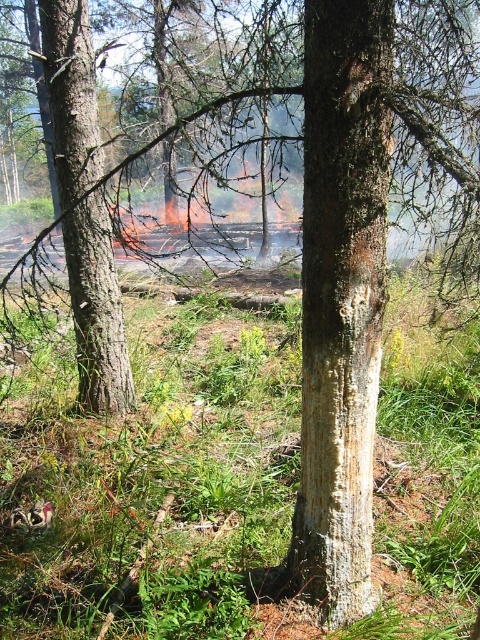
Is the position of smooth brown tree trunk at center more distant than that of smooth brown tree trunk at left?

No, it is in front of smooth brown tree trunk at left.

Is point (372, 365) in front of point (68, 227)?

Yes, point (372, 365) is in front of point (68, 227).

Between point (376, 188) and point (71, 157), which one is positioned in front?

Positioned in front is point (376, 188).

You are a GUI agent. You are given a task and a screenshot of the screen. Output one action in this format:
    pyautogui.click(x=<x>, y=<y>)
    Task: Click on the smooth brown tree trunk at center
    Image resolution: width=480 pixels, height=640 pixels.
    Given the screenshot: What is the action you would take?
    pyautogui.click(x=342, y=298)